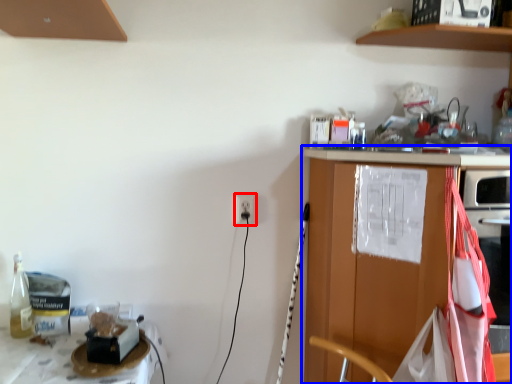
Question: Which object appears closest to the camera in this image, electric outlet (highlighted by a red box) or countertop (highlighted by a blue box)?

Choices:
 (A) electric outlet
 (B) countertop

Answer: (B)